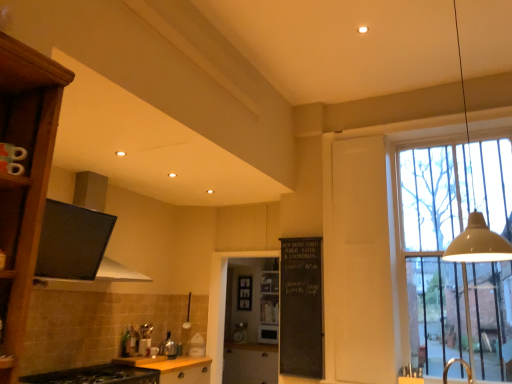
Locate an element on the screen. The height and width of the screenshot is (384, 512). free point above black chalkboard at center (from a real-world perspective) is located at coordinates (297, 237).